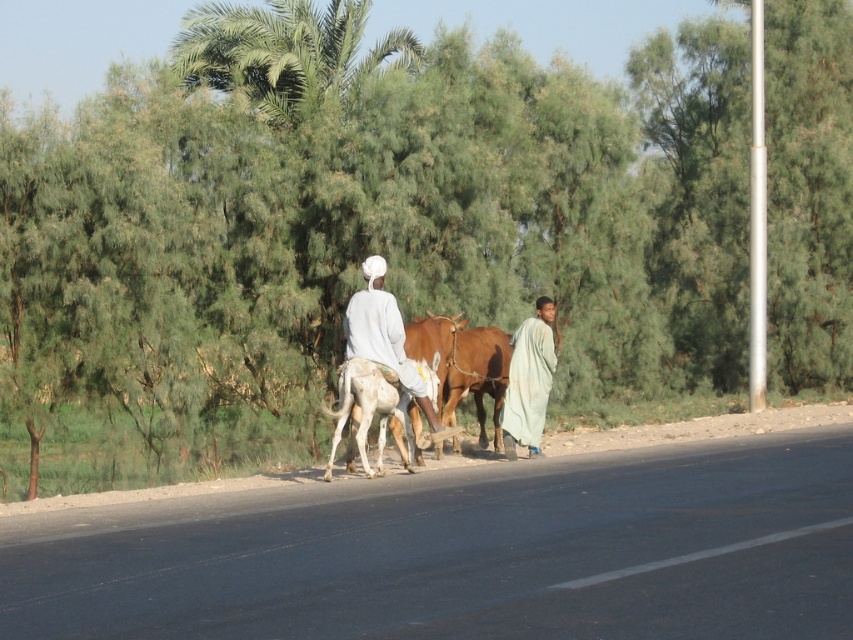
Is point (498, 388) closer to camera compared to point (331, 465)?

No, (498, 388) is further to viewer.

Which is more to the right, brown glossy bull at center or white smooth donkey at center?

brown glossy bull at center is more to the right.

Locate an element on the screen. This screenshot has height=640, width=853. brown glossy bull at center is located at coordinates (463, 364).

Between point (282, 122) and point (535, 317), which one is positioned behind?

The point (282, 122) is more distant.

From the picture: Who is shorter, green leafy palm tree at upper center or light green fabric at center?

Standing shorter between the two is light green fabric at center.

You are a GUI agent. You are given a task and a screenshot of the screen. Output one action in this format:
    pyautogui.click(x=<x>, y=<y>)
    Task: Click on the green leafy palm tree at upper center
    This screenshot has height=640, width=853.
    Given the screenshot: What is the action you would take?
    pyautogui.click(x=283, y=51)

In order to click on green leafy palm tree at upper center in this screenshot , I will do click(283, 51).

Which is in front, point (369, 269) or point (395, 408)?

Point (395, 408) is in front.

Looking at this image, which is more to the right, white cloth at center or white smooth donkey at center?

From the viewer's perspective, white cloth at center appears more on the right side.

Is point (375, 346) positioned after point (363, 452)?

Yes, it is.

Identify the location of white cloth at center. (386, 339).